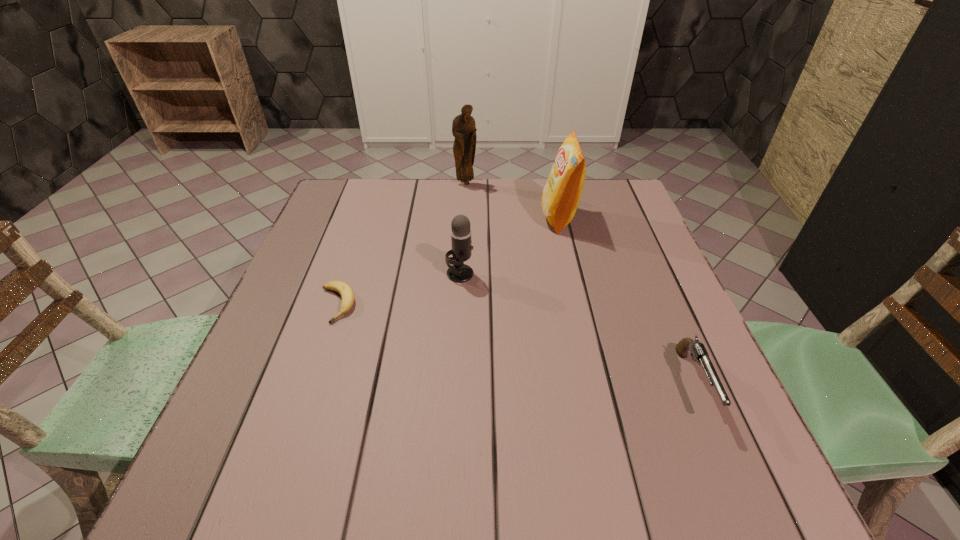
Where is `free space between the second object from right to left and the third tallest object`? This screenshot has width=960, height=540. free space between the second object from right to left and the third tallest object is located at coordinates (510, 246).

Identify the location of vacant area between the banana and the farthest object. (401, 244).

You are a GUI agent. You are given a task and a screenshot of the screen. Output one action in this format:
    pyautogui.click(x=<x>, y=<y>)
    Task: Click on the object that is the fourth closest to the second object from right to left
    The image size is (960, 540).
    Given the screenshot: What is the action you would take?
    pyautogui.click(x=347, y=295)

Point out which object is positioned as the second nearest to the third farthest object. Please provide its 2D coordinates. Your answer should be formatted as a tuple, i.e. [(x, y)], where the tuple contains the x and y coordinates of a point satisfying the conditions above.

[(560, 198)]

Identify the location of vacant space that satisfies the following two spatial constraints: 1. on the front-facing side of the second object from right to left; 2. on the front side of the second nearest object. pyautogui.click(x=579, y=305).

Identify the location of free point that satisfies the following two spatial constraints: 1. on the back side of the third shortest object; 2. on the right side of the leftmost object. (x=348, y=273).

Where is `vacant space that satisfies the following two spatial constraints: 1. on the front-facing side of the second farthest object; 2. on the front side of the shortest object`? The height and width of the screenshot is (540, 960). vacant space that satisfies the following two spatial constraints: 1. on the front-facing side of the second farthest object; 2. on the front side of the shortest object is located at coordinates (579, 305).